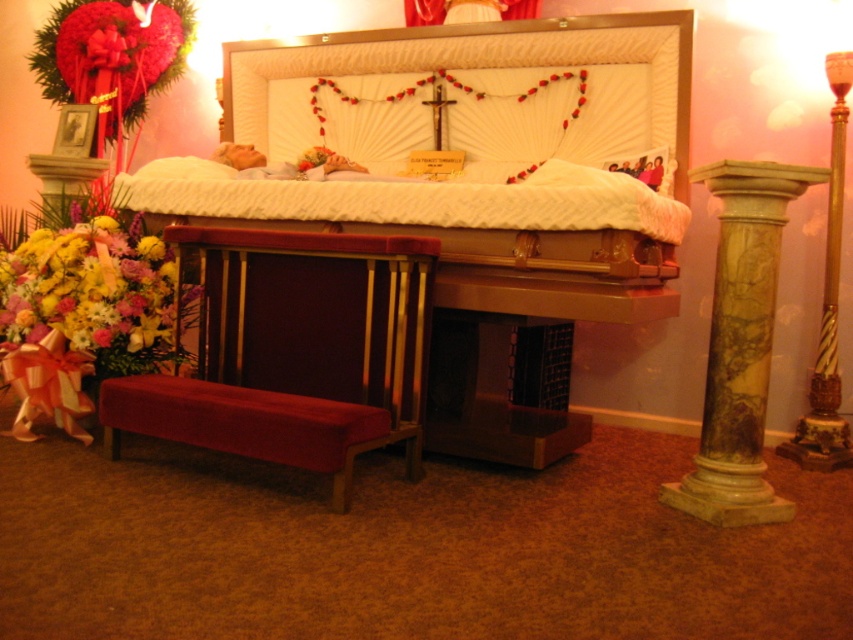
Is the position of white satin bed at center less distant than that of velvet red church bench at lower left?

No, it is not.

Does point (572, 312) lie behind point (285, 326)?

That is False.

Find the location of `white satin bed at center`. white satin bed at center is located at coordinates (x=476, y=160).

Between white satin bed at center and vibrant floral bouquet at lower left, which one has more height?

white satin bed at center

Is white satin bed at center bigger than vibrant floral bouquet at lower left?

Indeed, white satin bed at center has a larger size compared to vibrant floral bouquet at lower left.

Identify the location of white satin bed at center. This screenshot has width=853, height=640. (476, 160).

Identify the location of white satin bed at center. (476, 160).

From the picture: Is the position of velvet red church bench at lower left less distant than that of vibrant floral bouquet at lower left?

Yes, velvet red church bench at lower left is in front of vibrant floral bouquet at lower left.

Can you confirm if velvet red church bench at lower left is positioned to the right of vibrant floral bouquet at lower left?

Correct, you'll find velvet red church bench at lower left to the right of vibrant floral bouquet at lower left.

Who is more forward, (131, 376) or (120, 342)?

Point (131, 376) is in front.

At what (x,y) coordinates should I click in order to perform the action: click on velvet red church bench at lower left. Please return your answer as a coordinate pair (x, y). The image size is (853, 640). Looking at the image, I should click on (293, 352).